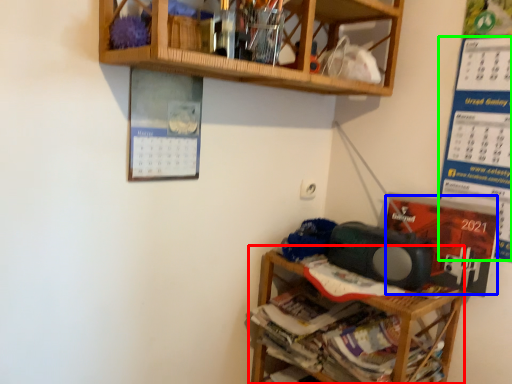
Question: Based on their relative distances, which object is nearer to shelf (highlighted by a red box)? Choose from writing (highlighted by a blue box) and writing (highlighted by a green box).

Choices:
 (A) writing
 (B) writing

Answer: (A)